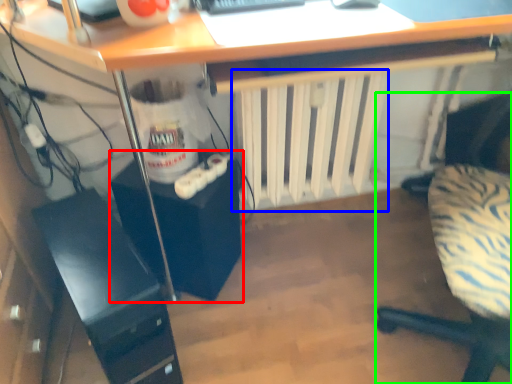
Question: Which is nearer to the computer tower (highlighted by a red box)? radiator (highlighted by a blue box) or chair (highlighted by a green box).

Choices:
 (A) radiator
 (B) chair

Answer: (A)